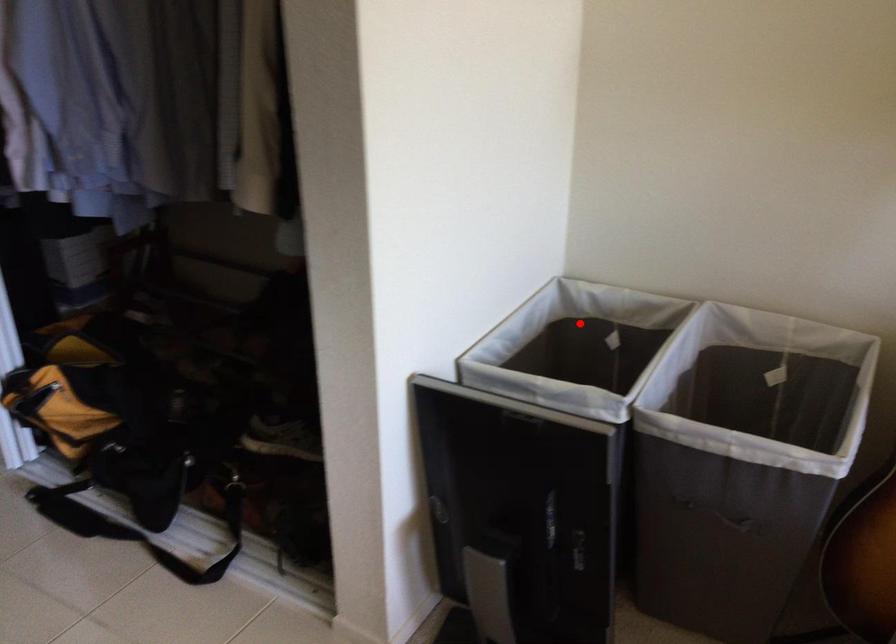
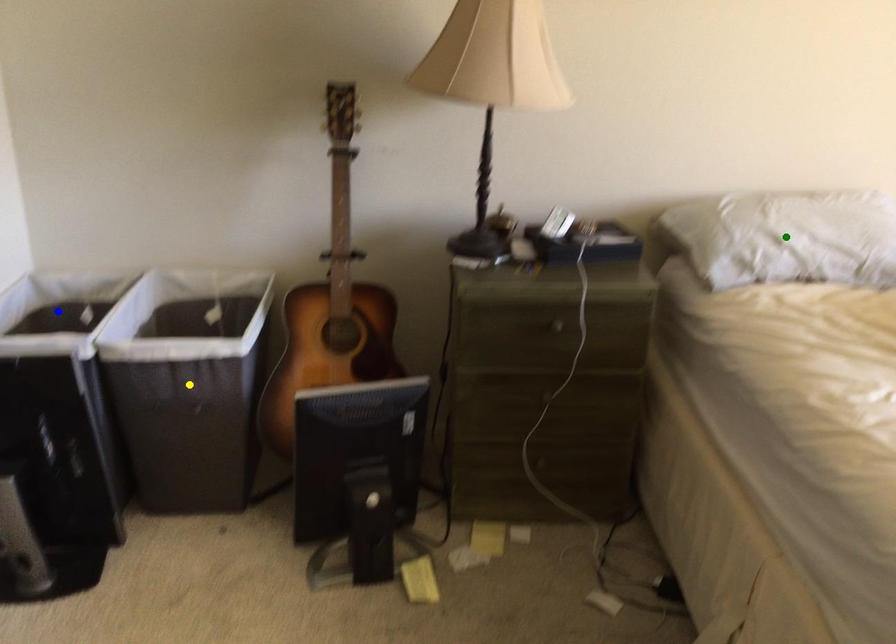
Question: I am providing you with two images of the same scene from different viewpoints. A red point is marked on the first image. You are given multiple points on the second image. Which point in image 2 represents the same 3d spot as the red point in image 1?

Choices:
 (A) blue point
 (B) yellow point
 (C) green point

Answer: (A)